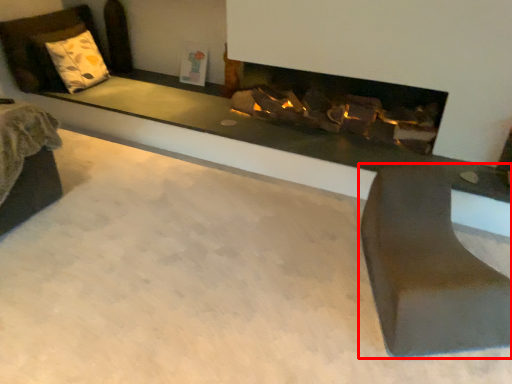
Question: From the image's perspective, what is the correct spatial positioning of furniture (annotated by the red box) in reference to pillow?

Choices:
 (A) below
 (B) above

Answer: (A)